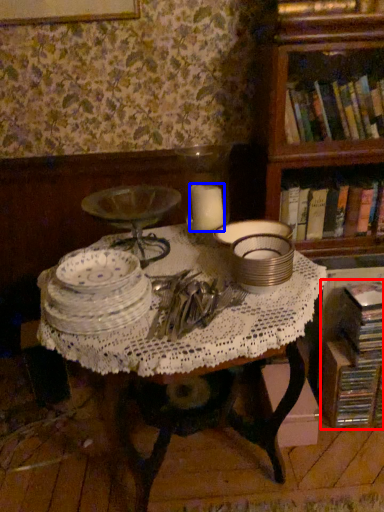
Question: Among these objects, which one is nearest to the camera, book (highlighted by a red box) or candle (highlighted by a blue box)?

Choices:
 (A) book
 (B) candle

Answer: (B)